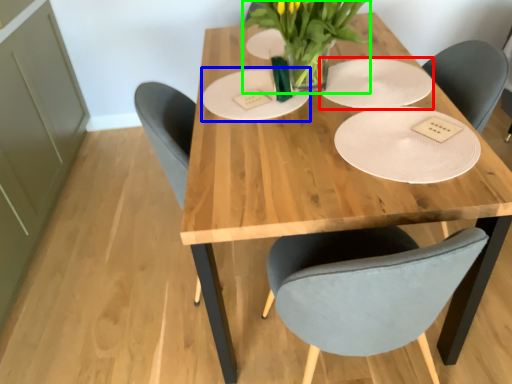
Question: Based on their relative distances, which object is farther from paper plate (highlighted by a red box)? Choose from paper plate (highlighted by a blue box) and floral arrangement (highlighted by a green box).

Choices:
 (A) paper plate
 (B) floral arrangement

Answer: (A)